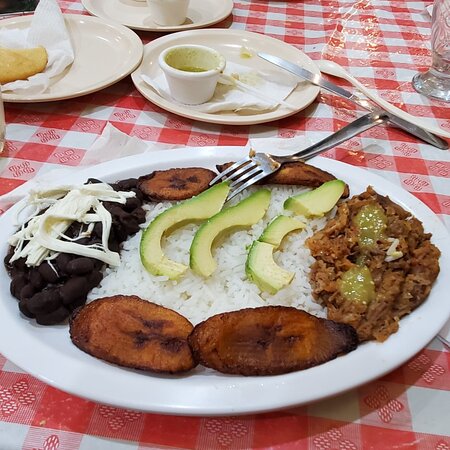
Locate an element on the screen. Image resolution: width=450 pixels, height=450 pixels. napkin is located at coordinates (114, 145), (288, 144), (232, 97), (52, 28).